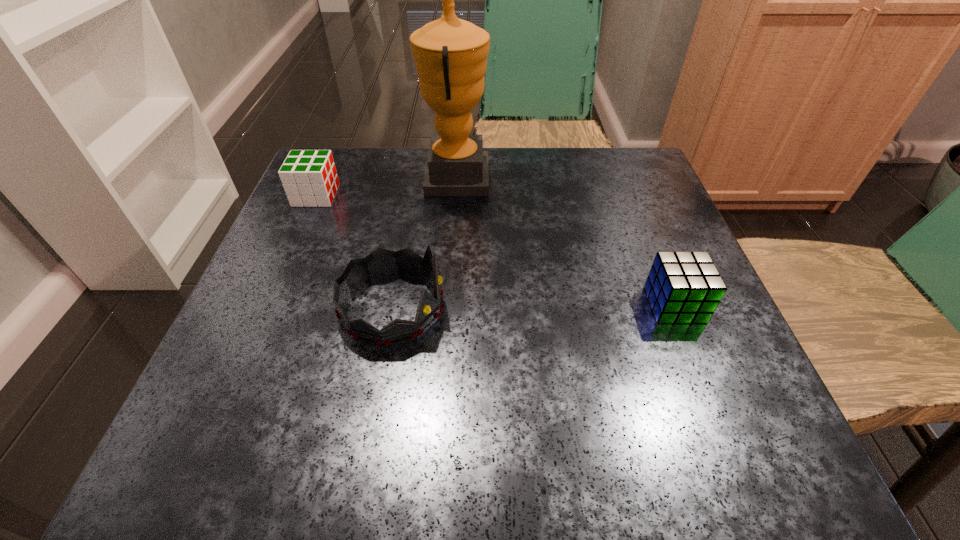
At what (x,y) coordinates should I click in order to perform the action: click on award at the far edge. Please return your answer as a coordinate pair (x, y). The height and width of the screenshot is (540, 960). Looking at the image, I should click on (450, 54).

What are the coordinates of `cube at the far edge` in the screenshot? It's located at (309, 177).

You are a GUI agent. You are given a task and a screenshot of the screen. Output one action in this format:
    pyautogui.click(x=<x>, y=<y>)
    Task: Click on the tiara present at the left edge
    The width and height of the screenshot is (960, 540).
    Given the screenshot: What is the action you would take?
    pyautogui.click(x=381, y=262)

Where is `cube that is at the left edge`? The width and height of the screenshot is (960, 540). cube that is at the left edge is located at coordinates (309, 177).

The width and height of the screenshot is (960, 540). What are the coordinates of `object that is at the right edge` in the screenshot? It's located at (683, 287).

This screenshot has width=960, height=540. Identify the location of object that is positioned at the far left corner. (309, 177).

At what (x,y) coordinates should I click in order to perform the action: click on free space at the far edge of the desktop. Please return your answer as a coordinate pair (x, y). Image resolution: width=960 pixels, height=540 pixels. Looking at the image, I should click on pos(534,152).

The height and width of the screenshot is (540, 960). Find the location of `vacant space at the near edge of the desktop`. vacant space at the near edge of the desktop is located at coordinates (595, 451).

In the image, there is a desktop. Where is `free space at the left edge`? This screenshot has width=960, height=540. free space at the left edge is located at coordinates (211, 376).

Where is `vacant space at the right edge of the desktop`? This screenshot has height=540, width=960. vacant space at the right edge of the desktop is located at coordinates (692, 359).